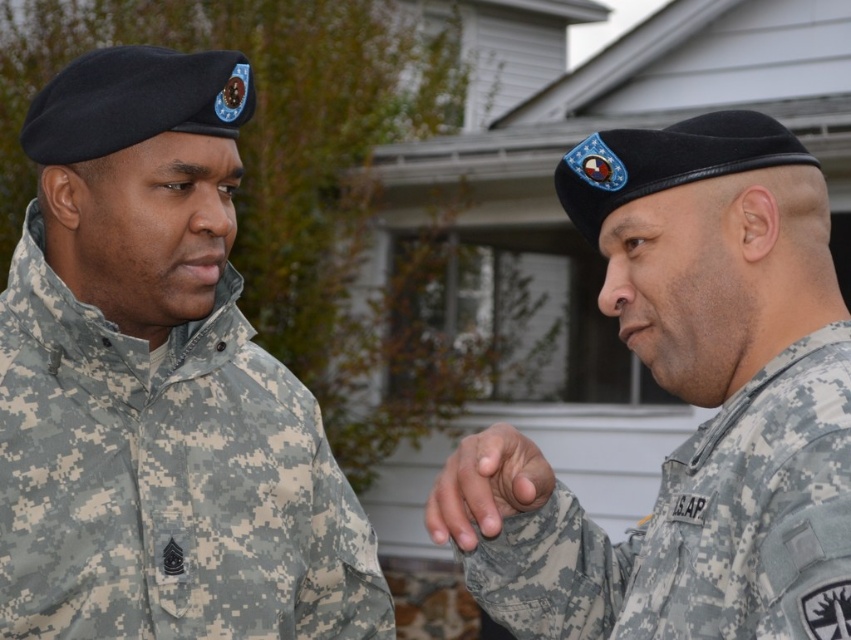
Question: Is camouflage fabric beret at center below camouflage fabric hand at center?

Choices:
 (A) no
 (B) yes

Answer: (A)

Question: Which object appears farthest from the camera in this image?

Choices:
 (A) camouflage fabric beret at center
 (B) camouflage fabric hand at center
 (C) camouflage fabric uniform at left

Answer: (C)

Question: Does camouflage fabric uniform at left have a lesser width compared to camouflage fabric hand at center?

Choices:
 (A) no
 (B) yes

Answer: (A)

Question: Which point is farther to the camera?

Choices:
 (A) camouflage fabric uniform at left
 (B) camouflage fabric beret at center
 (C) camouflage fabric hand at center

Answer: (A)

Question: Which object is closer to the camera taking this photo?

Choices:
 (A) camouflage fabric uniform at left
 (B) camouflage fabric hand at center

Answer: (B)

Question: Is camouflage fabric uniform at left smaller than camouflage fabric hand at center?

Choices:
 (A) yes
 (B) no

Answer: (B)